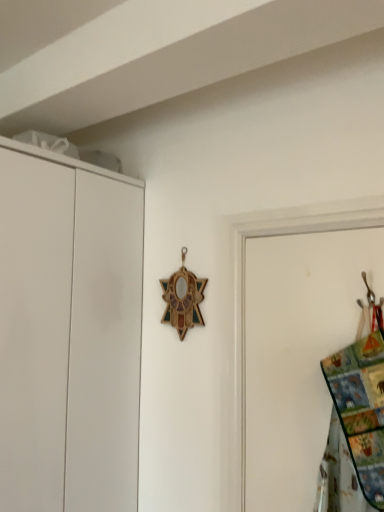
Where is `white matte cupboard at left`? Image resolution: width=384 pixels, height=512 pixels. white matte cupboard at left is located at coordinates (74, 330).

The height and width of the screenshot is (512, 384). What do you see at coordinates (74, 330) in the screenshot? I see `white matte cupboard at left` at bounding box center [74, 330].

In order to face white matte cupboard at left, should I rotate leftwards or rightwards?

A 22.435 degree turn to the left will do.

What do you see at coordinates (355, 425) in the screenshot?
I see `multicolored fabric at right` at bounding box center [355, 425].

The width and height of the screenshot is (384, 512). Identify the location of multicolored fabric at right. (355, 425).

Locate an element on the screen. The image size is (384, 512). white matte cupboard at left is located at coordinates (74, 330).

Can you confirm if multicolored fabric at right is positioned to the left of white matte cupboard at left?

No, multicolored fabric at right is not to the left of white matte cupboard at left.

Considering the positions of objects multicolored fabric at right and white matte cupboard at left in the image provided, who is behind, multicolored fabric at right or white matte cupboard at left?

white matte cupboard at left is further away from the camera.

Is point (362, 439) farther from viewer compared to point (28, 320)?

No, (362, 439) is closer to viewer.

From the image's perspective, is multicolored fabric at right positioned above or below white matte cupboard at left?

From the image's perspective, multicolored fabric at right appears above white matte cupboard at left.

From a real-world perspective, is multicolored fabric at right physically located above or below white matte cupboard at left?

multicolored fabric at right is below white matte cupboard at left.

Which of these two, multicolored fabric at right or white matte cupboard at left, is wider?

white matte cupboard at left is wider.

In the scene shown: Considering the relative sizes of multicolored fabric at right and white matte cupboard at left in the image provided, is multicolored fabric at right taller than white matte cupboard at left?

No, multicolored fabric at right is not taller than white matte cupboard at left.

In the scene shown: Considering the sizes of multicolored fabric at right and white matte cupboard at left in the image, is multicolored fabric at right bigger or smaller than white matte cupboard at left?

In the image, multicolored fabric at right appears to be smaller than white matte cupboard at left.

Would you say multicolored fabric at right is inside or outside white matte cupboard at left?

multicolored fabric at right cannot be found inside white matte cupboard at left.

Does multicolored fabric at right touch white matte cupboard at left?

No, multicolored fabric at right is not touching white matte cupboard at left.

Is multicolored fabric at right facing towards white matte cupboard at left?

No, multicolored fabric at right is not oriented towards white matte cupboard at left.

What's the angular difference between multicolored fabric at right and white matte cupboard at left's facing directions?

The angle between the facing direction of multicolored fabric at right and the facing direction of white matte cupboard at left is 91.8 degrees.

At what (x,y) coordinates should I click in order to perform the action: click on cupboard on the left of multicolored fabric at right. Please return your answer as a coordinate pair (x, y). This screenshot has width=384, height=512. Looking at the image, I should click on click(74, 330).

Is white matte cupboard at left at the right side of multicolored fabric at right?

In fact, white matte cupboard at left is to the left of multicolored fabric at right.

Is white matte cupboard at left closer to the viewer compared to multicolored fabric at right?

No, white matte cupboard at left is further to the viewer.

Is point (98, 308) more distant than point (337, 508)?

Yes, point (98, 308) is farther from viewer.

From the image's perspective, is white matte cupboard at left under multicolored fabric at right?

Yes.

From a real-world perspective, is white matte cupboard at left positioned above or below multicolored fabric at right?

From a real-world perspective, white matte cupboard at left is physically above multicolored fabric at right.

Which object is thinner, white matte cupboard at left or multicolored fabric at right?

With smaller width is multicolored fabric at right.

Does white matte cupboard at left have a lesser height compared to multicolored fabric at right?

No, white matte cupboard at left is not shorter than multicolored fabric at right.

Based on their sizes in the image, would you say white matte cupboard at left is bigger or smaller than multicolored fabric at right?

Clearly, white matte cupboard at left is larger in size than multicolored fabric at right.

Choose the correct answer: Is white matte cupboard at left inside multicolored fabric at right or outside it?

white matte cupboard at left exists outside the volume of multicolored fabric at right.

Are white matte cupboard at left and multicolored fabric at right located far from each other?

That's not correct — white matte cupboard at left is a little close to multicolored fabric at right.

Could you tell me if white matte cupboard at left is turned towards multicolored fabric at right?

Yes, white matte cupboard at left is facing multicolored fabric at right.

Where is `blanket on the right of white matte cupboard at left`? The image size is (384, 512). blanket on the right of white matte cupboard at left is located at coordinates (355, 425).

This screenshot has height=512, width=384. Find the location of `cupboard above the multicolored fabric at right (from a real-world perspective)`. cupboard above the multicolored fabric at right (from a real-world perspective) is located at coordinates (74, 330).

The height and width of the screenshot is (512, 384). What are the coordinates of `blanket below the white matte cupboard at left (from a real-world perspective)` in the screenshot? It's located at (355, 425).